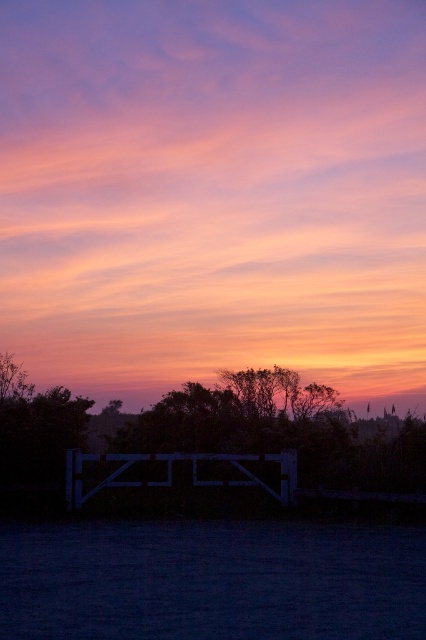
Question: Is green leafy tree at center bigger than black matte fence at center?

Choices:
 (A) yes
 (B) no

Answer: (A)

Question: Which object is farther from the camera taking this photo?

Choices:
 (A) black matte fence at center
 (B) green leafy tree at center

Answer: (A)

Question: Which object appears closest to the camera in this image?

Choices:
 (A) black matte fence at center
 (B) green leafy tree at center

Answer: (B)

Question: Is green leafy tree at center to the left of black matte fence at center from the viewer's perspective?

Choices:
 (A) yes
 (B) no

Answer: (B)

Question: Is green leafy tree at center below black matte fence at center?

Choices:
 (A) no
 (B) yes

Answer: (A)

Question: Which object appears closest to the camera in this image?

Choices:
 (A) black matte fence at center
 (B) green leafy tree at center

Answer: (B)